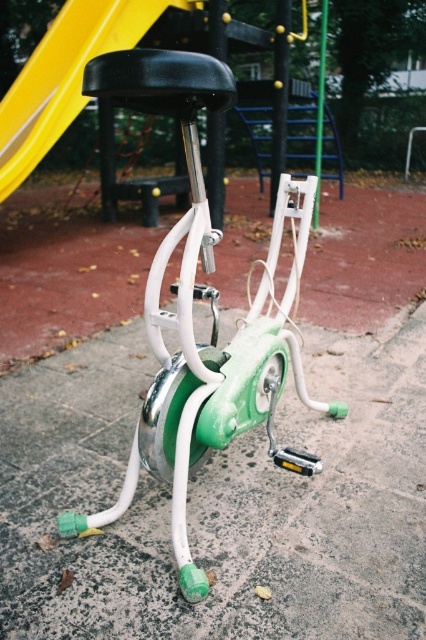
You are planning to move the green glossy exercise bike at center and the black plastic slide at upper center to another location. Based on their sizes, which object would require more space during transportation?

The black plastic slide at upper center requires more space during transportation because it occupies more space than the green glossy exercise bike at center.